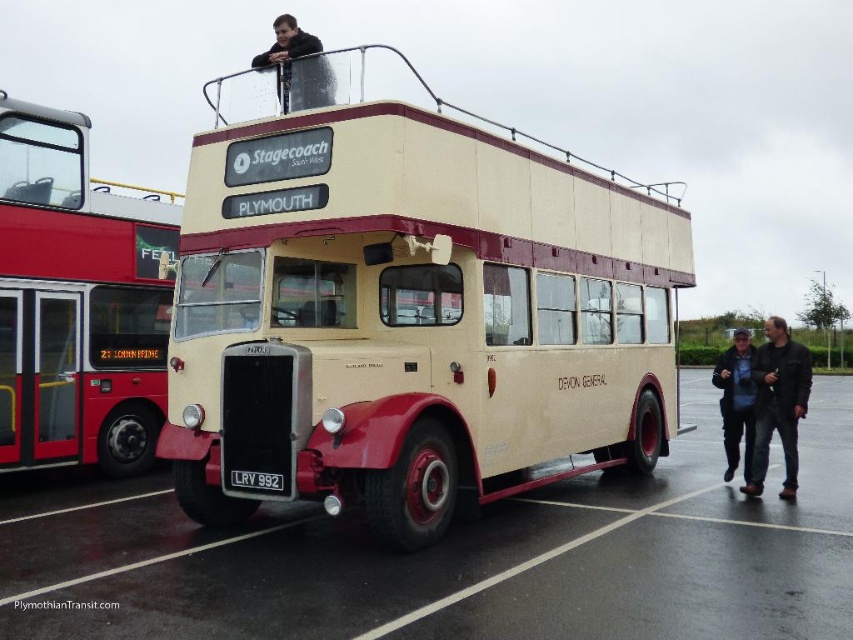
Based on the photo, you are a photographer standing in the parking lot and want to take a photo of the red metallic bus at left and the dark blue jacket at lower right. Which object should you zoom in on to make them appear the same size in the photo?

You should zoom in on the dark blue jacket at lower right because the red metallic bus at left is smaller than the dark blue jacket at lower right, so zooming in on the jacket will balance their sizes in the photo.

You are standing in the parking lot and see the beige matte bus at center and the black leather jacket at lower right. Which object is positioned more to the right side of the parking lot?

The black leather jacket at lower right is positioned more to the right side of the parking lot because the beige matte bus at center is to the left of it.